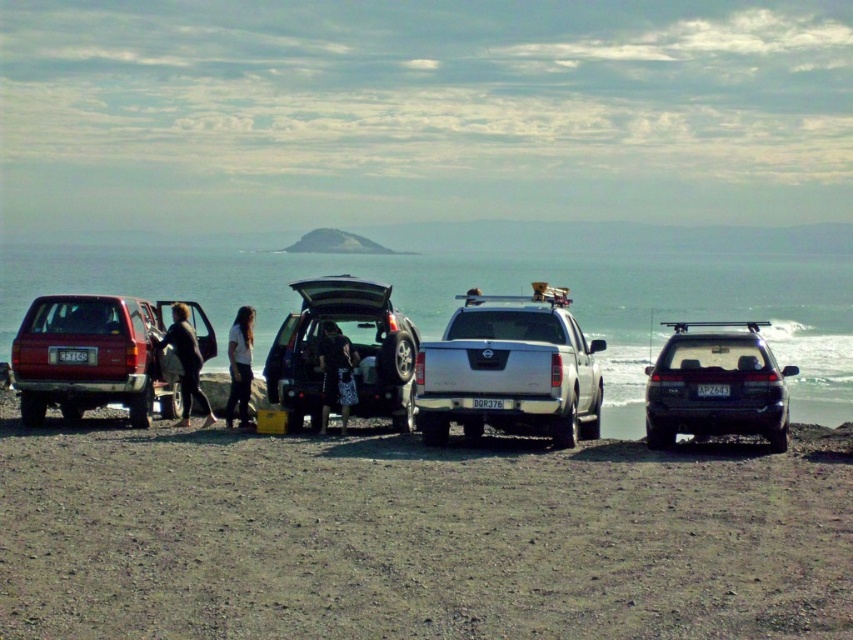
Question: Does brown sandy ground at lower center have a larger size compared to dark brown leather jacket at left?

Choices:
 (A) no
 (B) yes

Answer: (B)

Question: Which point appears closest to the camera in this image?

Choices:
 (A) (672, 364)
 (B) (247, 348)
 (C) (637, 614)
 (D) (390, 358)

Answer: (C)

Question: Estimate the real-world distances between objects in this image. Which object is closer to the dark brown leather jacket at left?

Choices:
 (A) silver metallic truck at center
 (B) dark gray fabric bag at center

Answer: (B)

Question: Where is brown sandy ground at lower center located in relation to white cotton shirt at center in the image?

Choices:
 (A) below
 (B) above

Answer: (A)

Question: Is silver metallic truck at center to the right of matte black suv at left from the viewer's perspective?

Choices:
 (A) yes
 (B) no

Answer: (A)

Question: Among these objects, which one is nearest to the camera?

Choices:
 (A) silver metallic truck at center
 (B) dark gray fabric bag at center

Answer: (A)